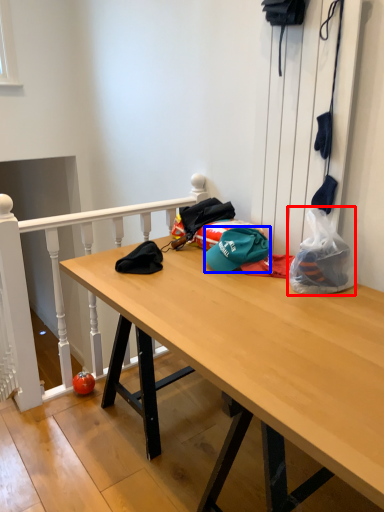
Question: Which object is further to the camera taking this photo, plastic bag (highlighted by a red box) or hat (highlighted by a blue box)?

Choices:
 (A) plastic bag
 (B) hat

Answer: (B)